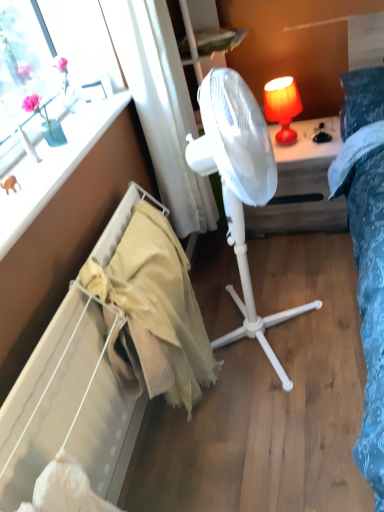
Identify the location of spots to the right of beige cotton blanket at lower left. (296, 401).